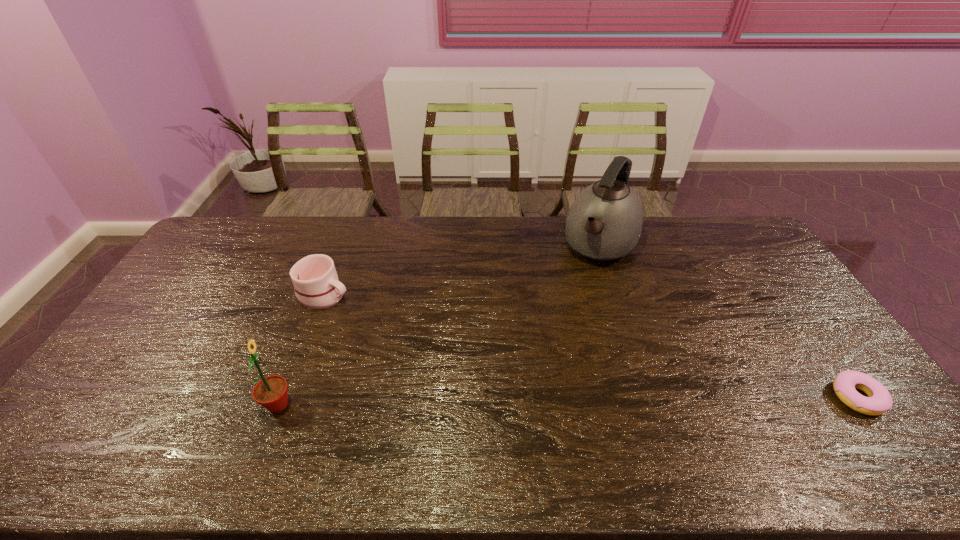
Locate an element on the screen. blank space at the far edge of the desktop is located at coordinates (286, 220).

Locate an element on the screen. This screenshot has height=540, width=960. vacant position at the near edge of the desktop is located at coordinates (354, 405).

Locate an element on the screen. vacant region at the left edge of the desktop is located at coordinates (191, 313).

Locate an element on the screen. The image size is (960, 540). vacant space at the right edge is located at coordinates (824, 379).

The width and height of the screenshot is (960, 540). Find the location of `free space at the far left corner`. free space at the far left corner is located at coordinates (257, 224).

At what (x,y) coordinates should I click in order to perform the action: click on free point between the farthest object and the sunflower. Please return your answer as a coordinate pair (x, y). The width and height of the screenshot is (960, 540). Looking at the image, I should click on (440, 326).

Locate an element on the screen. The height and width of the screenshot is (540, 960). free space between the second tallest object and the kettle is located at coordinates (440, 326).

The width and height of the screenshot is (960, 540). In order to click on blank region between the sunflower and the kettle in this screenshot , I will do `click(440, 326)`.

The height and width of the screenshot is (540, 960). Identify the location of vacant region between the sunflower and the tallest object. (440, 326).

This screenshot has width=960, height=540. In order to click on vacant space that is in between the sunflower and the doughnut in this screenshot , I will do `click(567, 401)`.